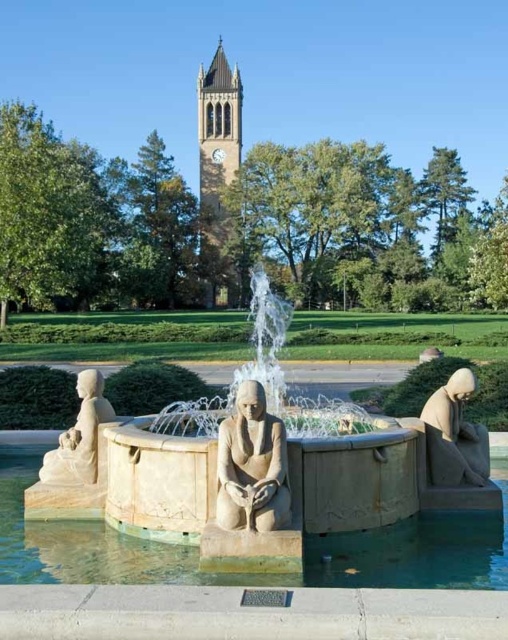
Question: Does smooth stone fountain at center have a lesser width compared to beige stone statue at lower left?

Choices:
 (A) no
 (B) yes

Answer: (A)

Question: Does beige stone fountain at center have a smaller size compared to matte stone statue at lower right?

Choices:
 (A) yes
 (B) no

Answer: (B)

Question: Which object is positioned closest to the beige stone fountain at center?

Choices:
 (A) beige stone statue at lower left
 (B) smooth stone statue at center

Answer: (B)

Question: Which of the following is the farthest from the observer?

Choices:
 (A) (172, 554)
 (B) (233, 525)
 (C) (201, 120)
 (D) (51, 467)

Answer: (C)

Question: Which object is farther from the camera taking this photo?

Choices:
 (A) beige stone clock tower at upper center
 (B) smooth stone statue at center
 (C) smooth stone fountain at center

Answer: (A)

Question: Can you confirm if smooth stone fountain at center is thinner than beige stone clock tower at upper center?

Choices:
 (A) yes
 (B) no

Answer: (B)